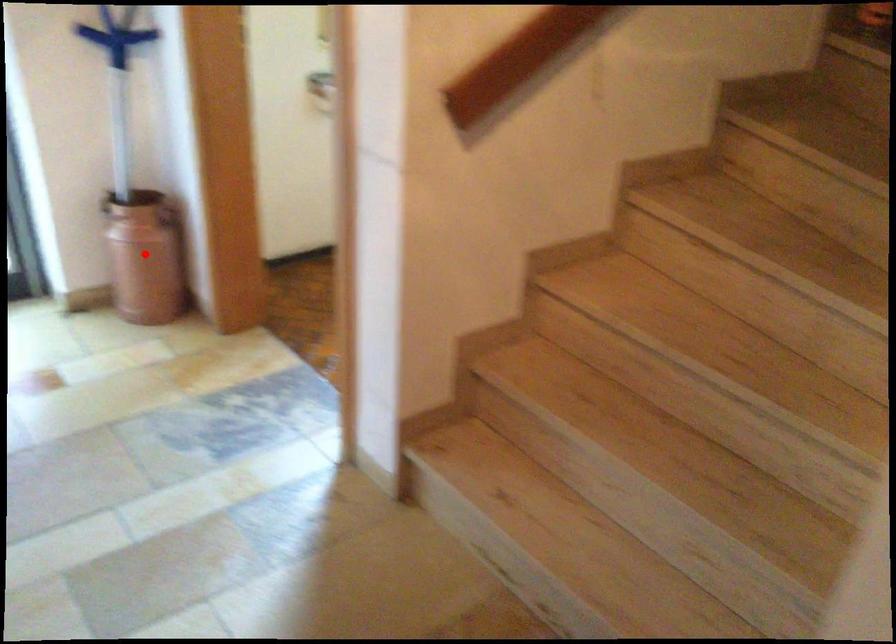
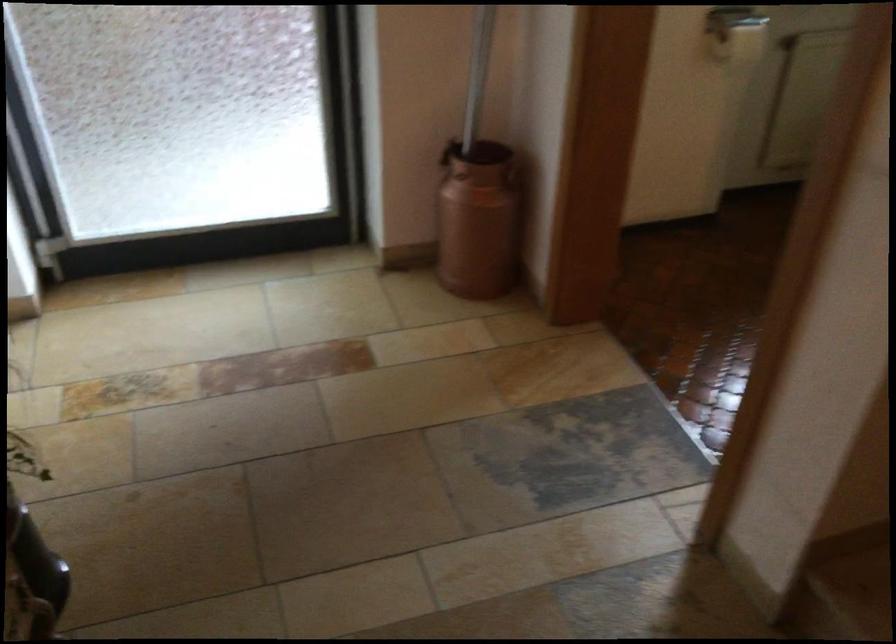
In the second image, find the point that corresponds to the highlighted location in the first image.

(478, 220)